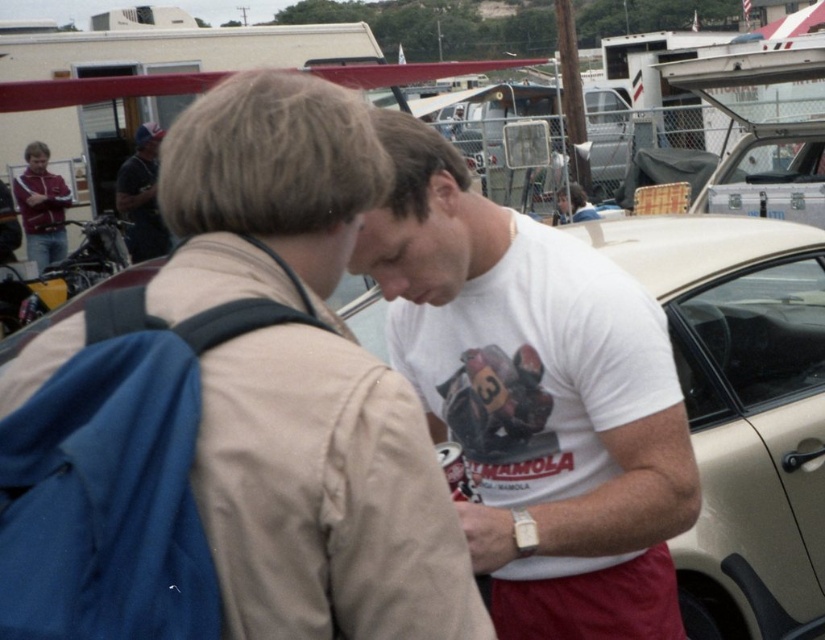
Question: Estimate the real-world distances between objects in this image. Which object is farther from the beige matte car at right?

Choices:
 (A) white cotton t-shirt at center
 (B) dark gray shirt at left

Answer: (B)

Question: Which object is farther from the camera taking this photo?

Choices:
 (A) white cotton t-shirt at center
 (B) dark gray shirt at left

Answer: (B)

Question: Which of the following is the farthest from the observer?

Choices:
 (A) beige matte car at right
 (B) dark gray shirt at left

Answer: (B)

Question: Does beige matte car at right appear over dark gray shirt at left?

Choices:
 (A) no
 (B) yes

Answer: (A)

Question: Observing the image, what is the correct spatial positioning of beige matte car at right in reference to dark gray shirt at left?

Choices:
 (A) left
 (B) right

Answer: (B)

Question: Is white cotton t-shirt at center bigger than beige matte car at right?

Choices:
 (A) no
 (B) yes

Answer: (A)